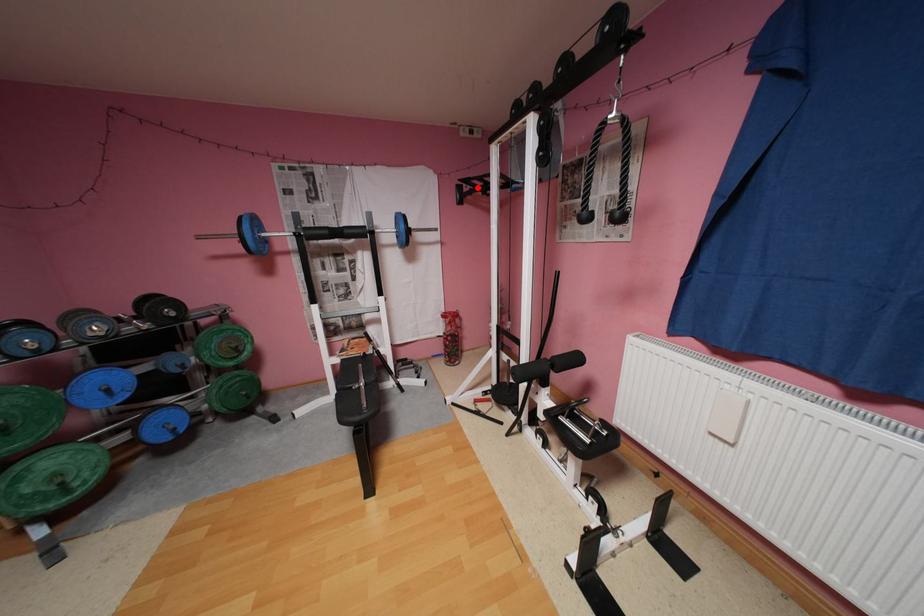
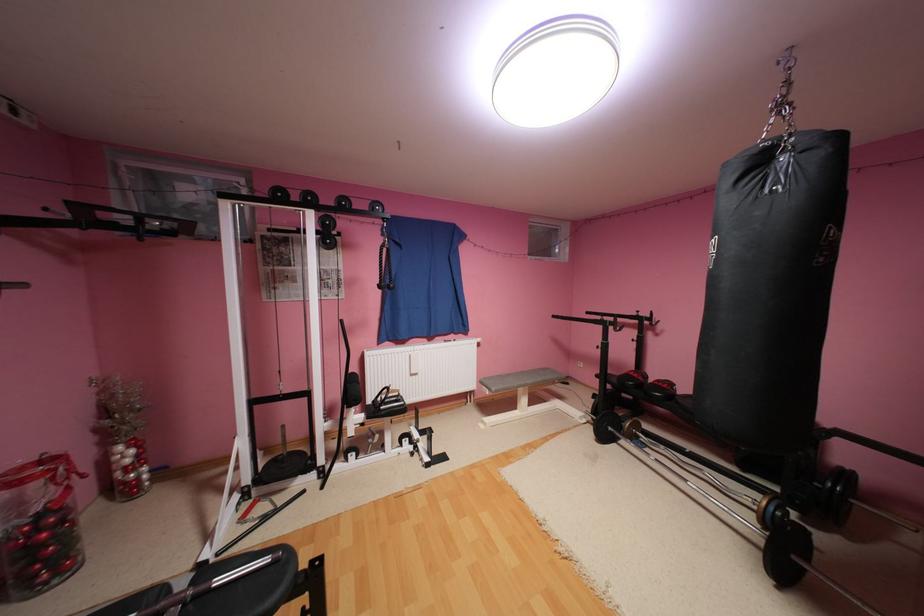
Find the pixel in the second image that matches the highlighted location in the first image.

(78, 216)